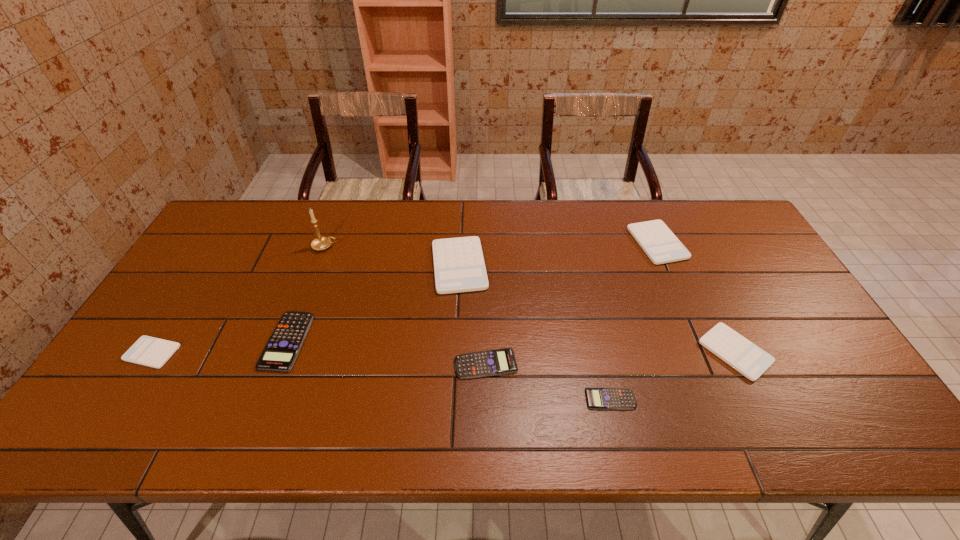
At what (x,y) coordinates should I click in order to perform the action: click on empty location between the tallest calculator and the nearest calculator. Please return your answer as a coordinate pair (x, y). The image size is (960, 540). Looking at the image, I should click on (535, 333).

This screenshot has width=960, height=540. Find the location of `free space between the third tallest object and the fourth tallest object`. free space between the third tallest object and the fourth tallest object is located at coordinates (696, 298).

You are a GUI agent. You are given a task and a screenshot of the screen. Output one action in this format:
    pyautogui.click(x=<x>, y=<y>)
    Task: Click on the free spot between the leftmost blue calculator and the leftmost object
    
    Given the screenshot: What is the action you would take?
    pyautogui.click(x=220, y=347)

Locate an element on the screen. Image resolution: width=960 pixels, height=540 pixels. empty space that is in between the fifth shortest calculator and the nearest blue calculator is located at coordinates (673, 375).

The width and height of the screenshot is (960, 540). Find the location of `object that ranks as the second closest to the second white calculator from left to right`. object that ranks as the second closest to the second white calculator from left to right is located at coordinates (320, 243).

Identify which object is the closest to the gold candle holder. Please provide its 2D coordinates. Your answer should be formatted as a tuple, i.e. [(x, y)], where the tuple contains the x and y coordinates of a point satisfying the conditions above.

[(281, 351)]

Choose which calculator is the third nearest neighbor to the smallest white calculator. Please provide its 2D coordinates. Your answer should be formatted as a tuple, i.e. [(x, y)], where the tuple contains the x and y coordinates of a point satisfying the conditions above.

[(495, 362)]

At what (x,y) coordinates should I click in order to perform the action: click on calculator that is the second closest one to the third tallest calculator. Please return your answer as a coordinate pair (x, y). This screenshot has width=960, height=540. Looking at the image, I should click on (659, 243).

This screenshot has height=540, width=960. Identify the location of white calculator that is the second closest one to the leftmost white calculator. (659, 243).

Select which white calculator appears as the closest to the second tallest object. Please provide its 2D coordinates. Your answer should be formatted as a tuple, i.e. [(x, y)], where the tuple contains the x and y coordinates of a point satisfying the conditions above.

[(659, 243)]